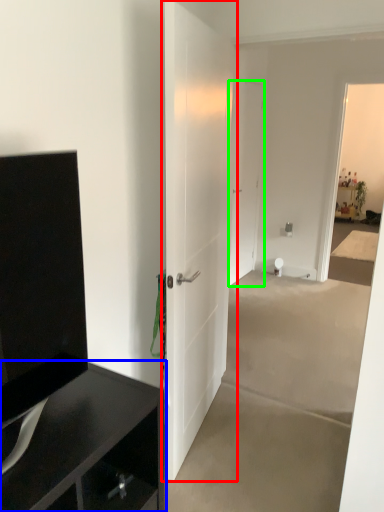
Question: Which object is positioned farthest from door (highlighted by a red box)? Select from cabinetry (highlighted by a blue box) and door (highlighted by a green box).

Choices:
 (A) cabinetry
 (B) door

Answer: (B)